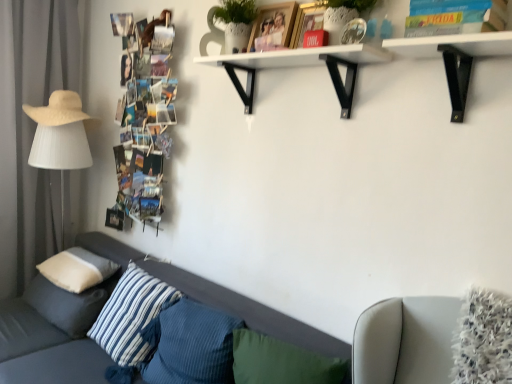
Question: Does white matte table lamp at left have a lesser width compared to white matte shelf at upper center?

Choices:
 (A) no
 (B) yes

Answer: (A)

Question: Is white matte table lamp at left not inside white matte shelf at upper center?

Choices:
 (A) no
 (B) yes

Answer: (B)

Question: Considering the relative positions of white matte table lamp at left and white matte shelf at upper center in the image provided, is white matte table lamp at left to the right of white matte shelf at upper center from the viewer's perspective?

Choices:
 (A) no
 (B) yes

Answer: (A)

Question: Can you confirm if white matte table lamp at left is taller than white matte shelf at upper center?

Choices:
 (A) no
 (B) yes

Answer: (B)

Question: Is white matte table lamp at left in contact with white matte shelf at upper center?

Choices:
 (A) yes
 (B) no

Answer: (B)

Question: Is white matte shelf at upper center in front of or behind textured gray couch at lower left in the image?

Choices:
 (A) front
 (B) behind

Answer: (B)

Question: From a real-world perspective, relative to textured gray couch at lower left, is white matte shelf at upper center vertically above or below?

Choices:
 (A) above
 (B) below

Answer: (A)

Question: Considering the positions of white matte shelf at upper center and textured gray couch at lower left in the image, is white matte shelf at upper center wider or thinner than textured gray couch at lower left?

Choices:
 (A) thin
 (B) wide

Answer: (A)

Question: Considering the positions of point (233, 71) and point (47, 377), is point (233, 71) closer or farther from the camera than point (47, 377)?

Choices:
 (A) closer
 (B) farther

Answer: (B)

Question: Considering their positions, is white matte pillow at left, the 2th pillow positioned from the left, located in front of or behind textured gray couch at lower left?

Choices:
 (A) front
 (B) behind

Answer: (B)

Question: Considering the positions of white matte pillow at left, which ranks as the third pillow in right-to-left order, and textured gray couch at lower left in the image, is white matte pillow at left, which ranks as the third pillow in right-to-left order, bigger or smaller than textured gray couch at lower left?

Choices:
 (A) small
 (B) big

Answer: (A)

Question: From the image's perspective, is white matte pillow at left, the 2th pillow positioned from the left, located above or below textured gray couch at lower left?

Choices:
 (A) below
 (B) above

Answer: (B)

Question: Is point (79, 269) positioned closer to the camera than point (350, 347)?

Choices:
 (A) farther
 (B) closer

Answer: (A)

Question: From the image's perspective, is white matte shelf at upper center above or below gray fabric curtain at left?

Choices:
 (A) below
 (B) above

Answer: (B)

Question: From their relative heights in the image, would you say white matte shelf at upper center is taller or shorter than gray fabric curtain at left?

Choices:
 (A) tall
 (B) short

Answer: (B)